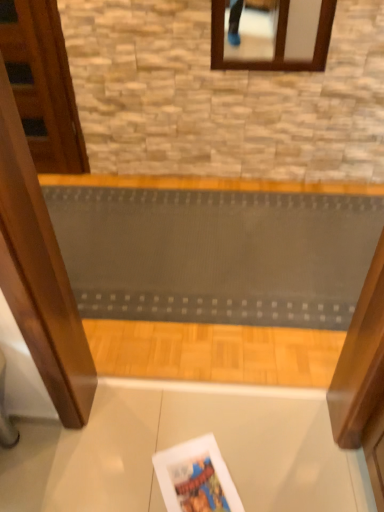
What do you see at coordinates (196, 478) in the screenshot?
I see `matte paper magazine at lower center` at bounding box center [196, 478].

Locate an element on the screen. The height and width of the screenshot is (512, 384). textured gray ramp at center is located at coordinates (216, 254).

Looking at their sizes, would you say wooden door at left is wider or thinner than textured gray ramp at center?

In the image, wooden door at left appears to be more narrow than textured gray ramp at center.

Can we say wooden door at left lies outside textured gray ramp at center?

Absolutely, wooden door at left is external to textured gray ramp at center.

From a real-world perspective, which is physically above, wooden door at left or textured gray ramp at center?

wooden door at left.

Looking at the image, does wooden door at left seem bigger or smaller compared to textured gray ramp at center?

wooden door at left is smaller than textured gray ramp at center.

From a real-world perspective, is textured gray ramp at center on top of wooden door at left?

No, from a real-world perspective, textured gray ramp at center is not above wooden door at left.

In the image, is textured gray ramp at center positioned in front of or behind wooden door at left?

textured gray ramp at center is in front of wooden door at left.

Does point (347, 249) appear closer or farther from the camera than point (52, 79)?

Clearly, point (347, 249) is closer to the camera than point (52, 79).

Choose the correct answer: Is textured gray ramp at center inside wooden door at left or outside it?

textured gray ramp at center is not inside wooden door at left, it's outside.

From a real-world perspective, which is physically above, textured gray ramp at center or matte paper magazine at lower center?

In real-world perspective, textured gray ramp at center is above.

Do you think textured gray ramp at center is within matte paper magazine at lower center, or outside of it?

textured gray ramp at center is not enclosed by matte paper magazine at lower center.

Where is `ramp on the right of matte paper magazine at lower center`? This screenshot has height=512, width=384. ramp on the right of matte paper magazine at lower center is located at coordinates (216, 254).

This screenshot has width=384, height=512. What are the coordinates of `ramp above the matte paper magazine at lower center (from a real-world perspective)` in the screenshot? It's located at (216, 254).

From a real-world perspective, is matte paper magazine at lower center physically above textured gray ramp at center?

Actually, matte paper magazine at lower center is physically below textured gray ramp at center in the real world.

Visually, is matte paper magazine at lower center positioned to the left or to the right of textured gray ramp at center?

Clearly, matte paper magazine at lower center is on the left of textured gray ramp at center in the image.

Can you confirm if matte paper magazine at lower center is thinner than textured gray ramp at center?

Yes.

From the image's perspective, would you say wooden door at left is positioned over matte paper magazine at lower center?

Correct, wooden door at left appears higher than matte paper magazine at lower center in the image.

Can you see wooden door at left touching matte paper magazine at lower center?

wooden door at left is not next to matte paper magazine at lower center, and they're not touching.

Is wooden door at left inside or outside of matte paper magazine at lower center?

wooden door at left cannot be found inside matte paper magazine at lower center.

Which object is more forward, wooden door at left or matte paper magazine at lower center?

matte paper magazine at lower center is in front.

Is matte paper magazine at lower center oriented away from wooden door at left?

That's not correct — matte paper magazine at lower center is not looking away from wooden door at left.

Is matte paper magazine at lower center bigger than wooden door at left?

No, matte paper magazine at lower center is not bigger than wooden door at left.

From a real-world perspective, is matte paper magazine at lower center over wooden door at left?

No, from a real-world perspective, matte paper magazine at lower center is not over wooden door at left

In the image, there is a wooden door at left. Identify the location of magazine below it (from the image's perspective). This screenshot has width=384, height=512. (196, 478).

This screenshot has width=384, height=512. Find the location of `ramp that is below the wooden door at left (from the image's perspective)`. ramp that is below the wooden door at left (from the image's perspective) is located at coordinates (216, 254).

Where is `ramp in front of the wooden door at left`? ramp in front of the wooden door at left is located at coordinates (216, 254).

Looking at this image, based on their spatial positions, is textured gray ramp at center or matte paper magazine at lower center closer to wooden door at left?

The object closer to wooden door at left is textured gray ramp at center.

Considering their positions, is wooden door at left positioned further to textured gray ramp at center than matte paper magazine at lower center?

matte paper magazine at lower center lies further to textured gray ramp at center than the other object.

Which object lies nearer to the anchor point matte paper magazine at lower center, wooden door at left or textured gray ramp at center?

textured gray ramp at center lies closer to matte paper magazine at lower center than the other object.

Which object lies nearer to the anchor point textured gray ramp at center, matte paper magazine at lower center or wooden door at left?

wooden door at left lies closer to textured gray ramp at center than the other object.

Which object lies further to the anchor point wooden door at left, matte paper magazine at lower center or textured gray ramp at center?

Among the two, matte paper magazine at lower center is located further to wooden door at left.

Considering their positions, is textured gray ramp at center positioned further to matte paper magazine at lower center than wooden door at left?

Among the two, wooden door at left is located further to matte paper magazine at lower center.

The height and width of the screenshot is (512, 384). In order to click on ramp between wooden door at left and matte paper magazine at lower center in the up-down direction in this screenshot , I will do `click(216, 254)`.